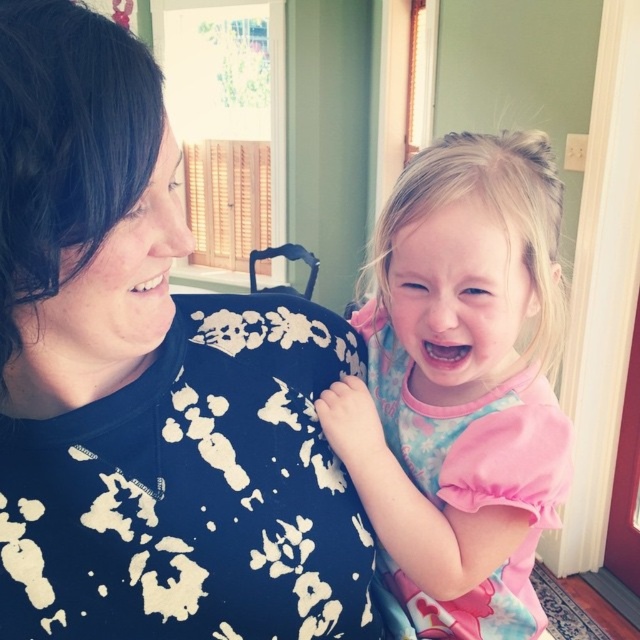
You are a photographer trying to capture the best shot of the scene. You notice the black floral shirt at upper left and the pink fabric dress at center. Which object should you focus on first if you want to highlight the one closer to the camera?

The black floral shirt at upper left is in front of the pink fabric dress at center, so you should focus on the black floral shirt at upper left first since it is closer to the camera.

You are standing in the living room and see the black floral shirt at upper left and the pink fabric dress at center. Which one is positioned more to the left side?

The black floral shirt at upper left is positioned more to the left side than the pink fabric dress at center.